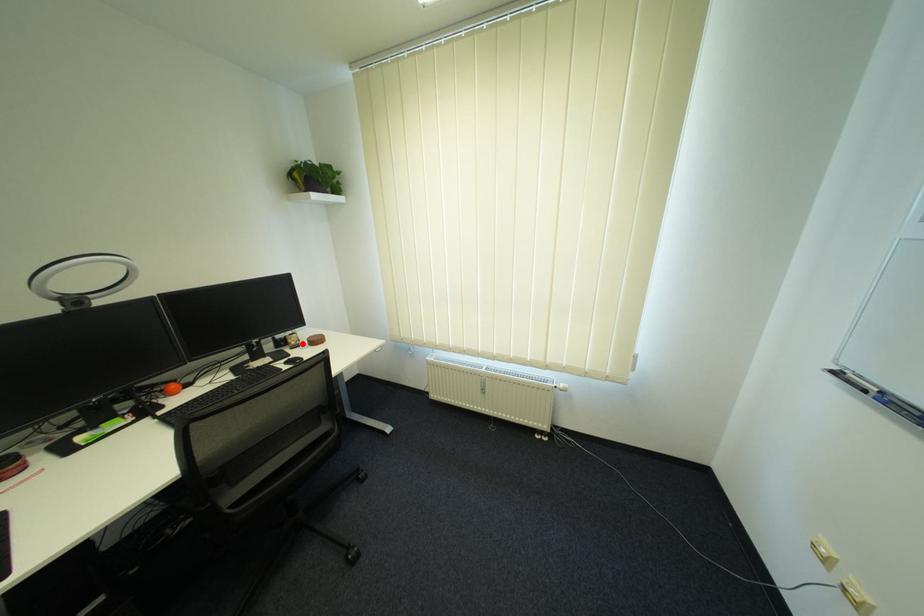
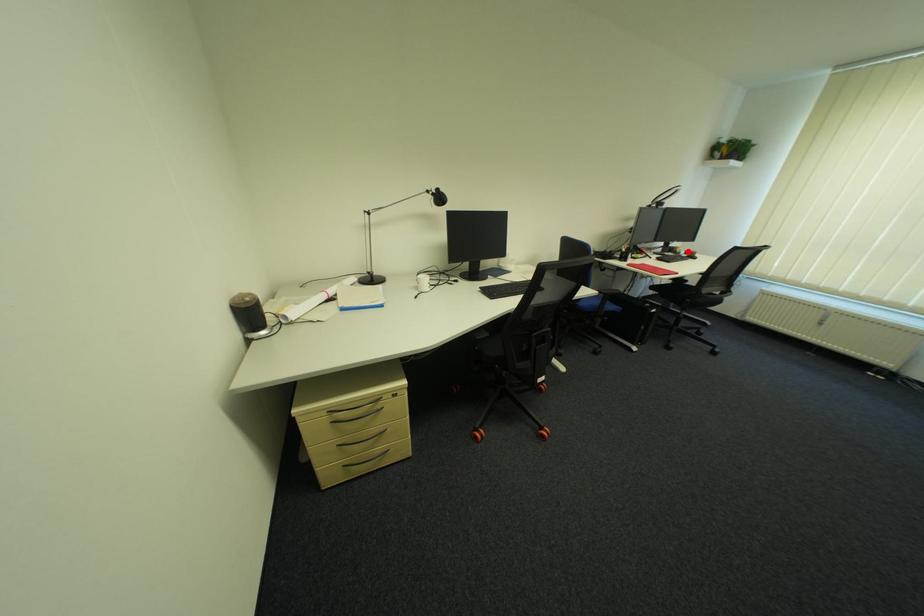
I am providing you with two images of the same scene from different viewpoints. A red point is marked on the first image and another point is marked on the second image. Is the red point in image1 aligned with the point shown in image2?

Yes